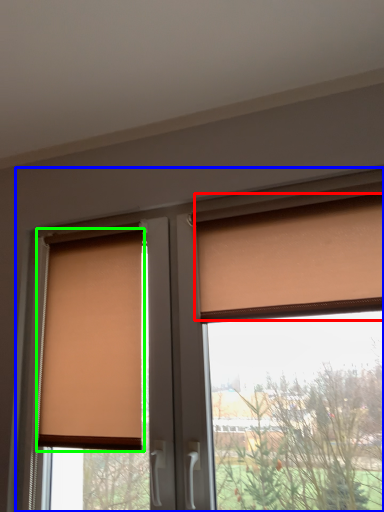
Question: Which object is the farthest from curtain (highlighted by a red box)? Choose among these: window (highlighted by a blue box) or window blind (highlighted by a green box).

Choices:
 (A) window
 (B) window blind

Answer: (B)